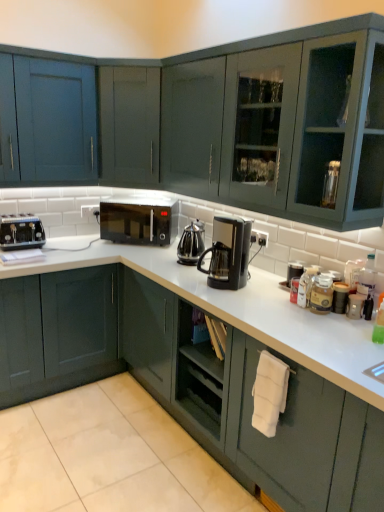
Question: From the image's perspective, relative to matte dark green cabinet at lower left, which ranks as the first cabinetry in bottom-to-top order, is white matte towel at lower right above or below?

Choices:
 (A) above
 (B) below

Answer: (B)

Question: Considering the positions of white matte towel at lower right and matte dark green cabinet at lower left, which ranks as the first cabinetry in bottom-to-top order, in the image, is white matte towel at lower right taller or shorter than matte dark green cabinet at lower left, which ranks as the first cabinetry in bottom-to-top order,?

Choices:
 (A) tall
 (B) short

Answer: (A)

Question: Which object is the farthest from the black matte microwave at center?

Choices:
 (A) white matte towel at lower right
 (B) matte blue cabinet at upper left, placed as the first cabinetry when sorted from top to bottom
 (C) black plastic coffee maker at center
 (D) black plastic coffee pot at center
 (E) matte dark green cabinet at lower left, which ranks as the first cabinetry in bottom-to-top order

Answer: (A)

Question: Considering the real-world distances, which object is farthest from the black matte microwave at center?

Choices:
 (A) matte blue cabinet at upper left, placed as the first cabinetry when sorted from top to bottom
 (B) matte dark green cabinet at lower left, which ranks as the first cabinetry in bottom-to-top order
 (C) metallic silver canister at right
 (D) black plastic coffee pot at center
 (E) matte black toaster at left

Answer: (C)